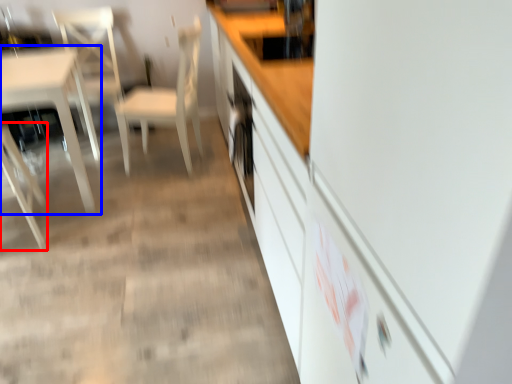
Question: Which object appears closest to the camera in this image, chair (highlighted by a red box) or table (highlighted by a blue box)?

Choices:
 (A) chair
 (B) table

Answer: (A)